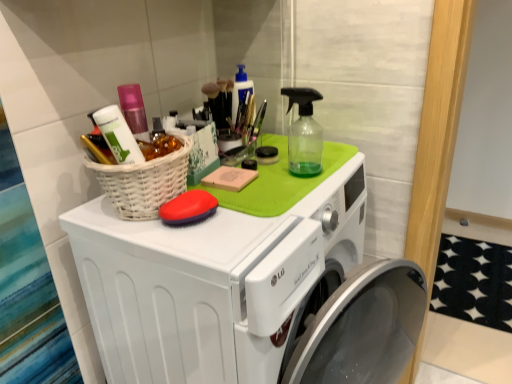
Question: Does white wicker basket at upper left have a larger size compared to red rubber brush at center?

Choices:
 (A) yes
 (B) no

Answer: (A)

Question: From a real-world perspective, is white wicker basket at upper left positioned over red rubber brush at center based on gravity?

Choices:
 (A) yes
 (B) no

Answer: (A)

Question: Is white wicker basket at upper left beside red rubber brush at center?

Choices:
 (A) yes
 (B) no

Answer: (A)

Question: Is white wicker basket at upper left outside red rubber brush at center?

Choices:
 (A) no
 (B) yes

Answer: (B)

Question: Does white wicker basket at upper left have a greater width compared to red rubber brush at center?

Choices:
 (A) yes
 (B) no

Answer: (A)

Question: Is white wicker basket at upper left at the left side of red rubber brush at center?

Choices:
 (A) no
 (B) yes

Answer: (B)

Question: Is the surface of red rubber brush at center in direct contact with white wicker basket at upper left?

Choices:
 (A) yes
 (B) no

Answer: (A)

Question: Can we say red rubber brush at center lies outside white wicker basket at upper left?

Choices:
 (A) no
 (B) yes

Answer: (A)

Question: Does red rubber brush at center turn towards white wicker basket at upper left?

Choices:
 (A) yes
 (B) no

Answer: (B)

Question: From the image's perspective, is red rubber brush at center located above white wicker basket at upper left?

Choices:
 (A) no
 (B) yes

Answer: (A)

Question: Is red rubber brush at center positioned far away from white wicker basket at upper left?

Choices:
 (A) yes
 (B) no

Answer: (B)

Question: Considering the relative sizes of red rubber brush at center and white wicker basket at upper left in the image provided, is red rubber brush at center shorter than white wicker basket at upper left?

Choices:
 (A) no
 (B) yes

Answer: (B)

Question: Can you confirm if white wicker basket at upper left is smaller than white plastic washing machine at upper center?

Choices:
 (A) yes
 (B) no

Answer: (A)